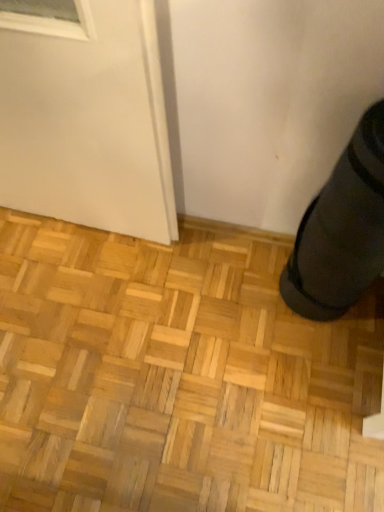
Question: Is black rubber shoe at lower right taller or shorter than natural wood parquet floor at lower right?

Choices:
 (A) short
 (B) tall

Answer: (B)

Question: In the image, is black rubber shoe at lower right on the left side or the right side of natural wood parquet floor at lower right?

Choices:
 (A) right
 (B) left

Answer: (A)

Question: Is black rubber shoe at lower right bigger or smaller than natural wood parquet floor at lower right?

Choices:
 (A) big
 (B) small

Answer: (B)

Question: From the image's perspective, is natural wood parquet floor at lower right above or below black rubber shoe at lower right?

Choices:
 (A) above
 (B) below

Answer: (B)

Question: In the image, is natural wood parquet floor at lower right positioned in front of or behind black rubber shoe at lower right?

Choices:
 (A) front
 (B) behind

Answer: (B)

Question: From a real-world perspective, relative to black rubber shoe at lower right, is natural wood parquet floor at lower right vertically above or below?

Choices:
 (A) above
 (B) below

Answer: (B)

Question: Visually, is natural wood parquet floor at lower right positioned to the left or to the right of black rubber shoe at lower right?

Choices:
 (A) right
 (B) left

Answer: (B)